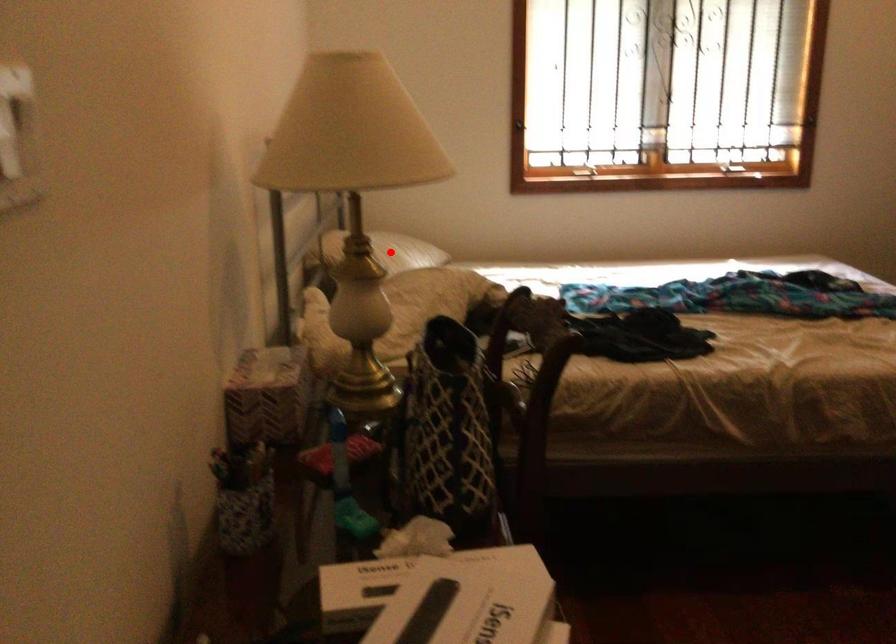
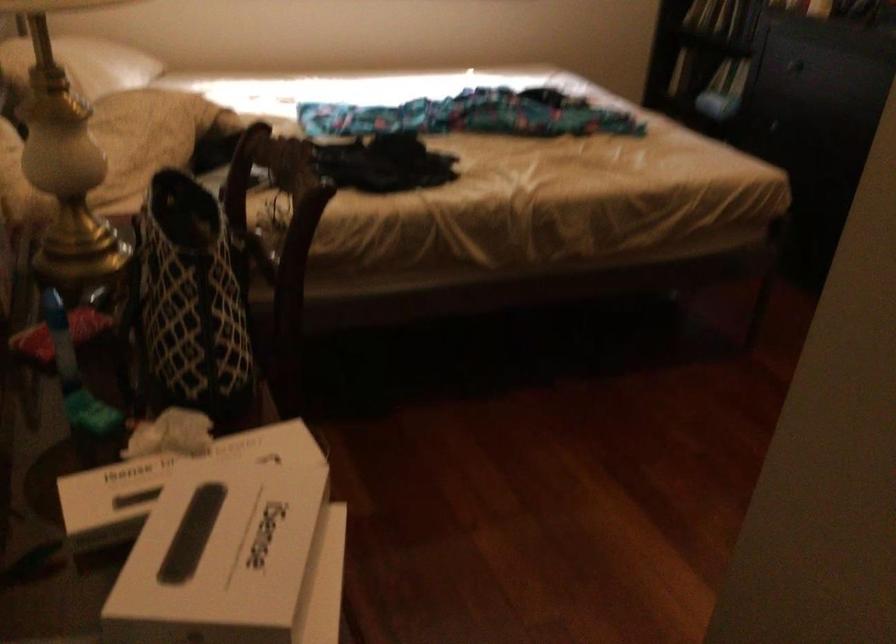
Locate, in the second image, the point that corresponds to the highlighted location in the first image.

(82, 64)